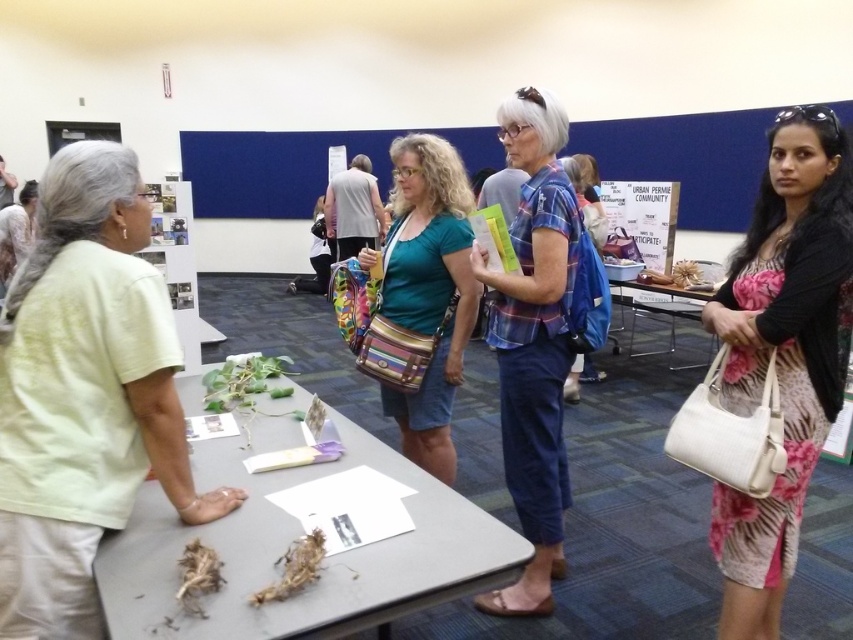
Question: Does gray matte table at center have a smaller size compared to pink floral dress at right?

Choices:
 (A) no
 (B) yes

Answer: (A)

Question: Considering the relative positions of pink floral dress at right and plaid fabric shirt at center in the image provided, where is pink floral dress at right located with respect to plaid fabric shirt at center?

Choices:
 (A) above
 (B) below

Answer: (B)

Question: Which point is closer to the camera?

Choices:
 (A) metallic silver table at center
 (B) gray matte table at center
 (C) teal fabric purse at center
 (D) pink floral dress at right

Answer: (B)

Question: Can you confirm if teal fabric purse at center is smaller than metallic silver table at center?

Choices:
 (A) yes
 (B) no

Answer: (A)

Question: Considering the real-world distances, which object is closest to the metallic silver table at center?

Choices:
 (A) pink floral dress at right
 (B) teal fabric purse at center
 (C) plaid fabric shirt at center

Answer: (B)

Question: Which of the following is the closest to the observer?

Choices:
 (A) (631, 355)
 (B) (100, 252)
 (C) (744, 292)

Answer: (B)